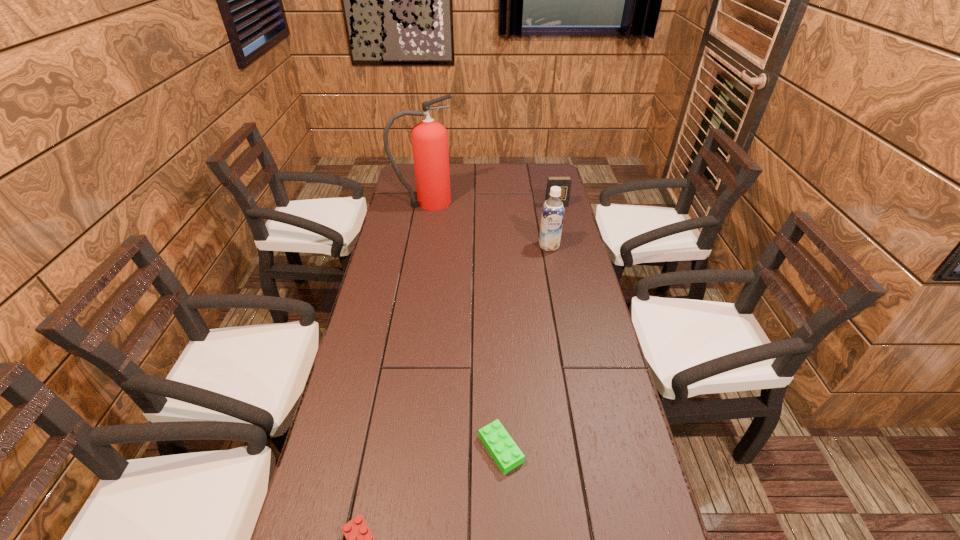
Find the location of a particular element. The height and width of the screenshot is (540, 960). free spot between the third farthest object and the right Lego is located at coordinates (525, 347).

Point out which object is positioned as the third nearest to the third shortest object. Please provide its 2D coordinates. Your answer should be formatted as a tuple, i.e. [(x, y)], where the tuple contains the x and y coordinates of a point satisfying the conditions above.

[(505, 452)]

The width and height of the screenshot is (960, 540). Find the location of `object identified as the third closest to the soya milk`. object identified as the third closest to the soya milk is located at coordinates (505, 452).

At what (x,y) coordinates should I click in order to perform the action: click on vacant space that satisfies the following two spatial constraints: 1. on the handle side of the tallest object; 2. on the right side of the second nearest object. Please return your answer as a coordinate pair (x, y). Looking at the image, I should click on (382, 449).

You are a GUI agent. You are given a task and a screenshot of the screen. Output one action in this format:
    pyautogui.click(x=<x>, y=<y>)
    Task: Click on the free space that satisfies the following two spatial constraints: 1. on the handle side of the farther Lego; 2. on the left side of the fire extinguisher
    This screenshot has width=960, height=540.
    Given the screenshot: What is the action you would take?
    pyautogui.click(x=382, y=449)